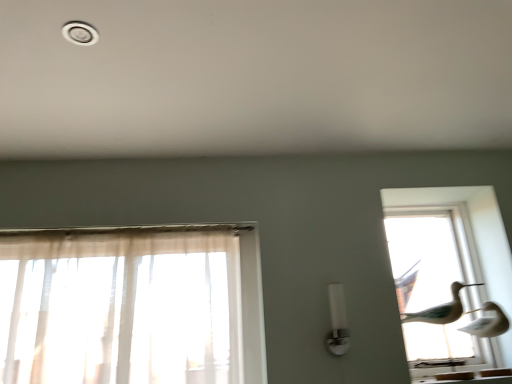
Question: Is the depth of white glossy light fixture at center less than that of white plastic light fixture at upper left?

Choices:
 (A) no
 (B) yes

Answer: (A)

Question: Can you confirm if white glossy light fixture at center is bigger than white plastic light fixture at upper left?

Choices:
 (A) yes
 (B) no

Answer: (A)

Question: Is there a large distance between white glossy light fixture at center and white plastic light fixture at upper left?

Choices:
 (A) yes
 (B) no

Answer: (A)

Question: From the image's perspective, is white glossy light fixture at center on top of white plastic light fixture at upper left?

Choices:
 (A) no
 (B) yes

Answer: (A)

Question: Considering the relative sizes of white glossy light fixture at center and white plastic light fixture at upper left in the image provided, is white glossy light fixture at center wider than white plastic light fixture at upper left?

Choices:
 (A) yes
 (B) no

Answer: (B)

Question: Would you say transparent glass birds at right is inside or outside white plastic light fixture at upper left?

Choices:
 (A) inside
 (B) outside

Answer: (B)

Question: Would you say transparent glass birds at right is to the left or to the right of white plastic light fixture at upper left in the picture?

Choices:
 (A) right
 (B) left

Answer: (A)

Question: Looking at the image, does transparent glass birds at right seem bigger or smaller compared to white plastic light fixture at upper left?

Choices:
 (A) big
 (B) small

Answer: (A)

Question: From the image's perspective, relative to white plastic light fixture at upper left, is transparent glass birds at right above or below?

Choices:
 (A) below
 (B) above

Answer: (A)

Question: Is white glossy light fixture at center to the left or to the right of white plastic light fixture at upper left in the image?

Choices:
 (A) right
 (B) left

Answer: (A)

Question: From their relative heights in the image, would you say white glossy light fixture at center is taller or shorter than white plastic light fixture at upper left?

Choices:
 (A) tall
 (B) short

Answer: (A)

Question: From a real-world perspective, is white glossy light fixture at center positioned above or below white plastic light fixture at upper left?

Choices:
 (A) below
 (B) above

Answer: (A)

Question: Is white glossy light fixture at center situated inside white plastic light fixture at upper left or outside?

Choices:
 (A) inside
 (B) outside

Answer: (B)

Question: From a real-world perspective, relative to transparent glass birds at right, is white plastic light fixture at upper left vertically above or below?

Choices:
 (A) below
 (B) above

Answer: (B)

Question: Would you say white plastic light fixture at upper left is inside or outside transparent glass birds at right?

Choices:
 (A) inside
 (B) outside

Answer: (B)